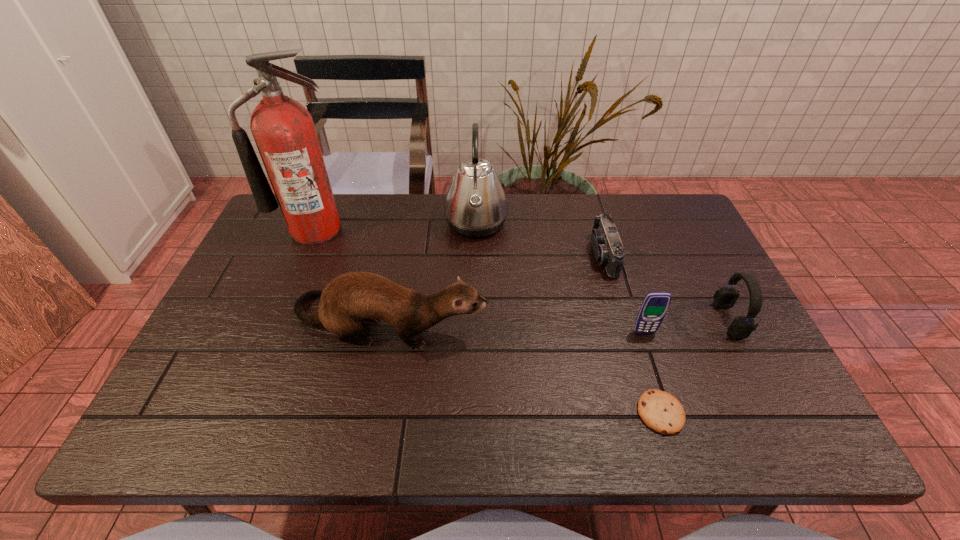
You are a GUI agent. You are given a task and a screenshot of the screen. Output one action in this format:
    pyautogui.click(x=<x>, y=<y>)
    Task: Click on the fire extinguisher
    This screenshot has width=960, height=540.
    Given the screenshot: What is the action you would take?
    pyautogui.click(x=283, y=129)

Locate an element on the screen. This screenshot has height=540, width=960. the sixth shortest object is located at coordinates (475, 206).

Locate an element on the screen. ferret is located at coordinates 348,299.

The image size is (960, 540). Find the location of `headset`. headset is located at coordinates (741, 327).

Where is `cellular telephone`? cellular telephone is located at coordinates (655, 304).

Image resolution: width=960 pixels, height=540 pixels. Identify the location of camcorder. (606, 243).

Identify the location of the shortest object. The height and width of the screenshot is (540, 960). (662, 412).

At what (x,y) coordinates should I click in order to perform the action: click on cookie. Please return your answer as a coordinate pair (x, y). The height and width of the screenshot is (540, 960). Looking at the image, I should click on (662, 412).

The height and width of the screenshot is (540, 960). I want to click on free space located on the front of the fire extinguisher near the operation label, so click(x=285, y=303).

Locate an element on the screen. The image size is (960, 540). blank space located from the spout of the second tallest object is located at coordinates (613, 223).